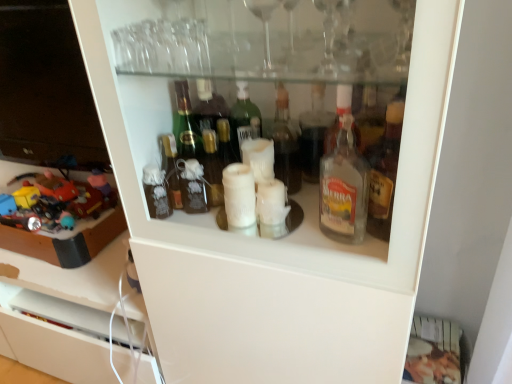
Question: Can we say plastic toy car at left, the 2th toy viewed from the left, lies outside plastic toys at left, arranged as the first toy when viewed from the left?

Choices:
 (A) yes
 (B) no

Answer: (B)

Question: Is plastic toy car at left, placed as the first toy when sorted from right to left, facing away from plastic toys at left, positioned as the second toy in right-to-left order?

Choices:
 (A) yes
 (B) no

Answer: (B)

Question: Is the surface of plastic toy car at left, placed as the first toy when sorted from right to left, in direct contact with plastic toys at left, arranged as the first toy when viewed from the left?

Choices:
 (A) no
 (B) yes

Answer: (B)

Question: Considering the relative sizes of plastic toy car at left, placed as the first toy when sorted from right to left, and plastic toys at left, arranged as the first toy when viewed from the left, in the image provided, is plastic toy car at left, placed as the first toy when sorted from right to left, wider than plastic toys at left, arranged as the first toy when viewed from the left,?

Choices:
 (A) yes
 (B) no

Answer: (B)

Question: Is plastic toys at left, arranged as the first toy when viewed from the left, surrounded by plastic toy car at left, the 2th toy viewed from the left?

Choices:
 (A) no
 (B) yes

Answer: (A)

Question: From a real-world perspective, is plastic toy car at left, placed as the first toy when sorted from right to left, over plastic toys at left, positioned as the second toy in right-to-left order?

Choices:
 (A) no
 (B) yes

Answer: (B)

Question: Can you confirm if plastic toys at left, arranged as the first toy when viewed from the left, is thinner than plastic toy car at left, the 2th toy viewed from the left?

Choices:
 (A) yes
 (B) no

Answer: (B)

Question: Is plastic toys at left, positioned as the second toy in right-to-left order, far from plastic toy car at left, the 2th toy viewed from the left?

Choices:
 (A) no
 (B) yes

Answer: (A)

Question: Is plastic toys at left, arranged as the first toy when viewed from the left, to the left of plastic toy car at left, the 2th toy viewed from the left, from the viewer's perspective?

Choices:
 (A) no
 (B) yes

Answer: (B)

Question: Can you confirm if plastic toys at left, positioned as the second toy in right-to-left order, is wider than plastic toy car at left, placed as the first toy when sorted from right to left?

Choices:
 (A) no
 (B) yes

Answer: (B)

Question: From the image's perspective, is plastic toys at left, positioned as the second toy in right-to-left order, located beneath plastic toy car at left, placed as the first toy when sorted from right to left?

Choices:
 (A) yes
 (B) no

Answer: (A)

Question: Is plastic toy car at left, the 2th toy viewed from the left, completely or partially inside plastic toys at left, arranged as the first toy when viewed from the left?

Choices:
 (A) yes
 (B) no

Answer: (A)

Question: Considering the positions of plastic toy car at left, the 2th toy viewed from the left, and plastic toys at left, arranged as the first toy when viewed from the left, in the image, is plastic toy car at left, the 2th toy viewed from the left, bigger or smaller than plastic toys at left, arranged as the first toy when viewed from the left,?

Choices:
 (A) small
 (B) big

Answer: (A)